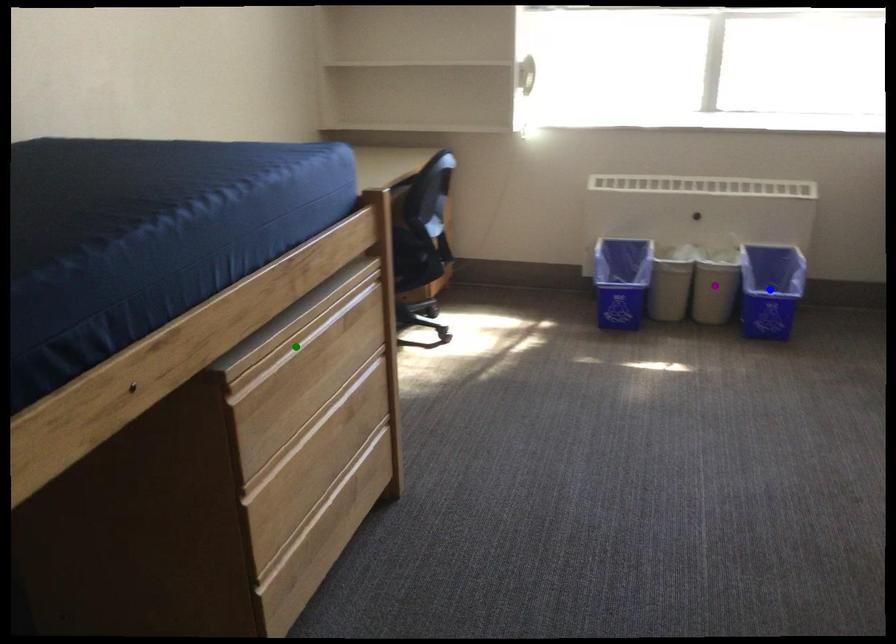
Order these from nearest to farthest:
A) purple point
B) green point
C) blue point

green point
purple point
blue point